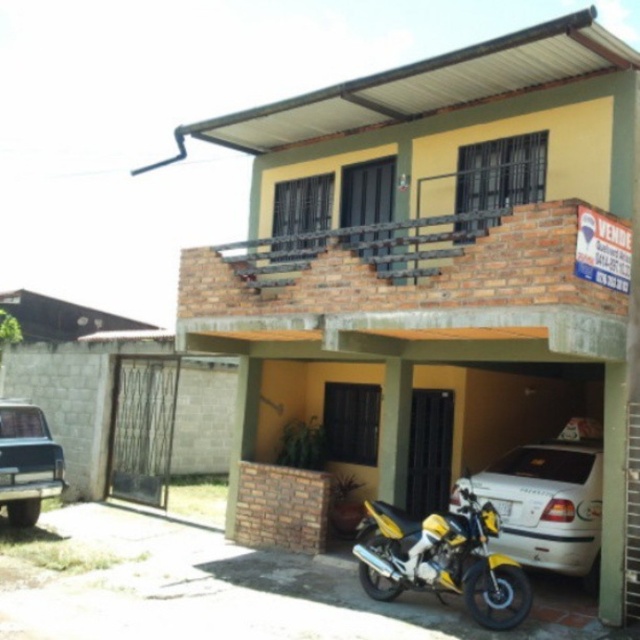
You are standing at the entrance of the residential building and want to park your new motorcycle exactly where the yellow matte motorcycle at lower center is currently parked. What are the coordinates you should aim for?

You should aim for the coordinates point (442, 561) where the yellow matte motorcycle at lower center is parked.

In the scene shown: You are a delivery person trying to park your van in the driveway next to the white matte car at lower right and the yellow matte motorcycle at lower center. Since your van is 2 meters wide, can you fit it between them without touching either vehicle?

The white matte car at lower right is wider than the yellow matte motorcycle at lower center. However, the exact distance between them isn not specified. Without knowing the space between the vehicles, it is impossible to determine if the van will fit.